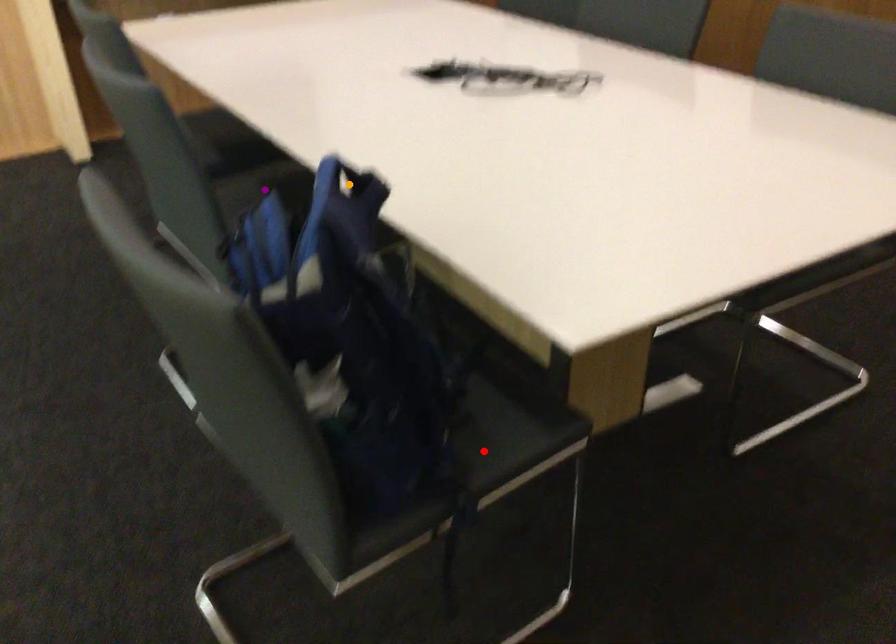
Based on the photo, order these from nearest to farthest:
orange point, purple point, red point

orange point, purple point, red point